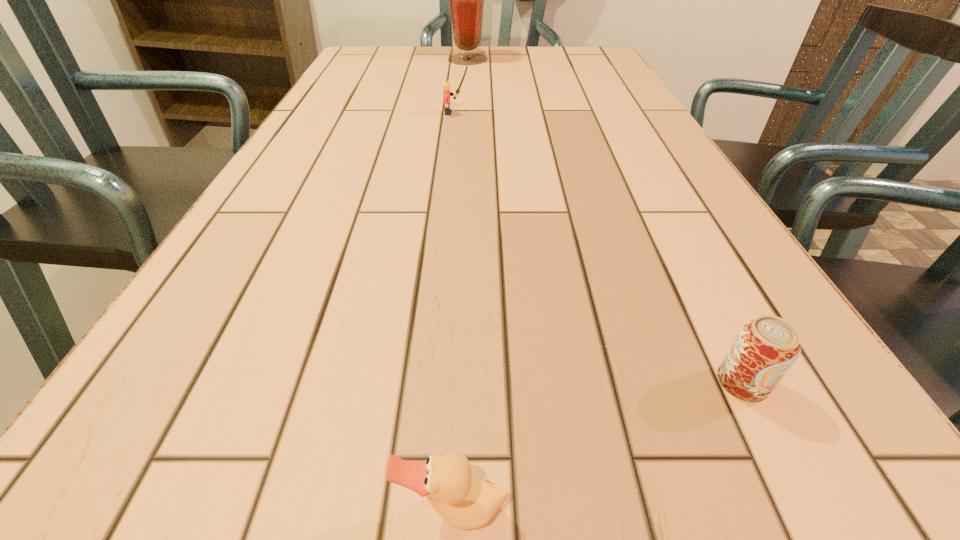
Find the location of a particular element. The height and width of the screenshot is (540, 960). free space between the duck and the rightmost object is located at coordinates (597, 446).

Locate an element on the screen. This screenshot has height=540, width=960. free space between the nearest object and the second farthest object is located at coordinates (454, 311).

Where is `free spot between the Lego and the duck`? This screenshot has width=960, height=540. free spot between the Lego and the duck is located at coordinates (454, 311).

You are a GUI agent. You are given a task and a screenshot of the screen. Output one action in this format:
    pyautogui.click(x=<x>, y=<y>)
    Task: Click on the free spot between the tallest object and the duck
    
    Given the screenshot: What is the action you would take?
    pyautogui.click(x=460, y=284)

Find the location of `empty location between the farthest object and the rightmost object`. empty location between the farthest object and the rightmost object is located at coordinates (605, 220).

Where is `free space between the Lego and the beer can`? free space between the Lego and the beer can is located at coordinates (599, 247).

Locate an element on the screen. empty space that is in between the Lego and the duck is located at coordinates (454, 311).

You are a GUI agent. You are given a task and a screenshot of the screen. Output one action in this format:
    pyautogui.click(x=<x>, y=<y>)
    Task: Click on the object that ranks as the second closest to the duck
    
    Given the screenshot: What is the action you would take?
    pyautogui.click(x=446, y=85)

Image resolution: width=960 pixels, height=540 pixels. I want to click on object that can be found as the closest to the Lego, so click(466, 0).